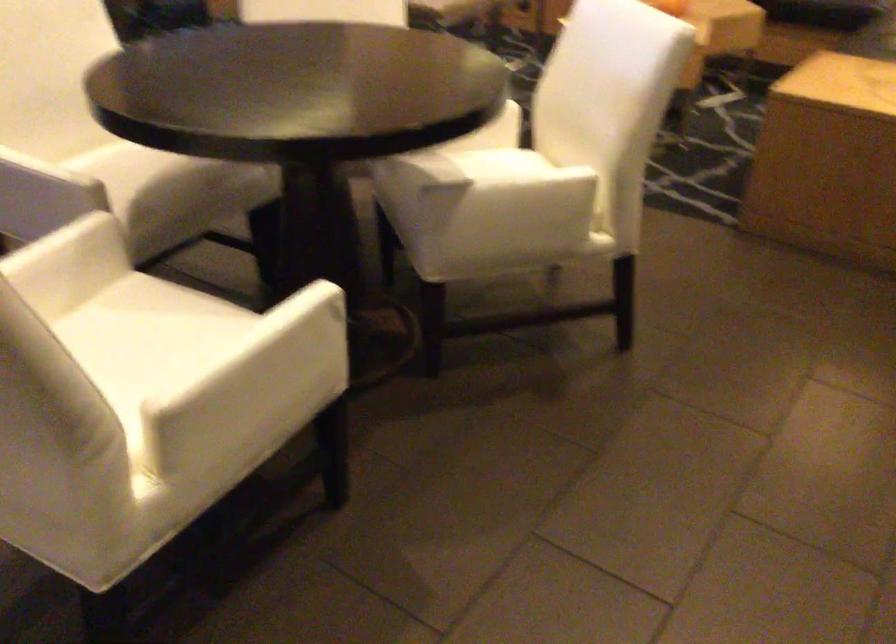
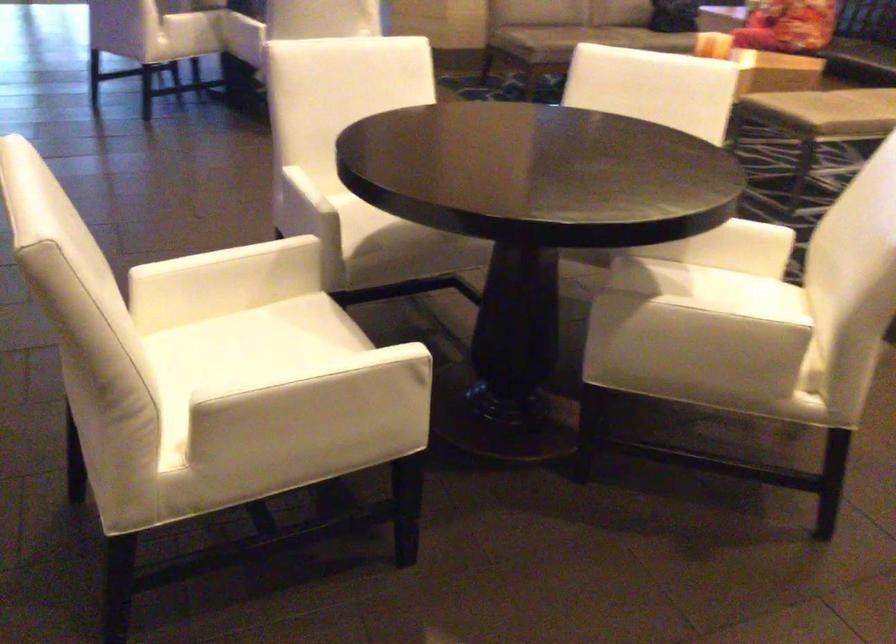
Locate, in the second image, the point that corresponds to pixel 479 171 in the first image.

(711, 290)